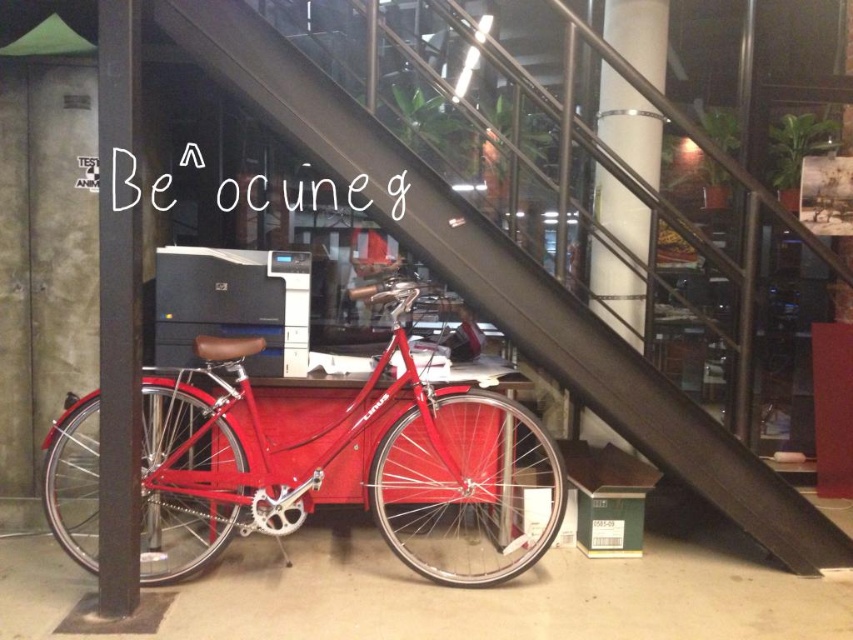
Question: Which point appears closest to the camera in this image?

Choices:
 (A) (120, 160)
 (B) (64, 529)

Answer: (A)

Question: Is glossy red bicycle at center above metallic gray pole at left?

Choices:
 (A) yes
 (B) no

Answer: (B)

Question: Does metallic staircase at center have a smaller size compared to metallic gray pole at left?

Choices:
 (A) no
 (B) yes

Answer: (A)

Question: Observing the image, what is the correct spatial positioning of glossy red bicycle at center in reference to metallic gray pole at left?

Choices:
 (A) above
 (B) below

Answer: (B)

Question: Among these points, which one is nearest to the camera?

Choices:
 (A) (524, 344)
 (B) (433, 516)
 (C) (109, 196)

Answer: (C)

Question: Which point is farther to the camera?

Choices:
 (A) metallic gray pole at left
 (B) metallic staircase at center

Answer: (B)